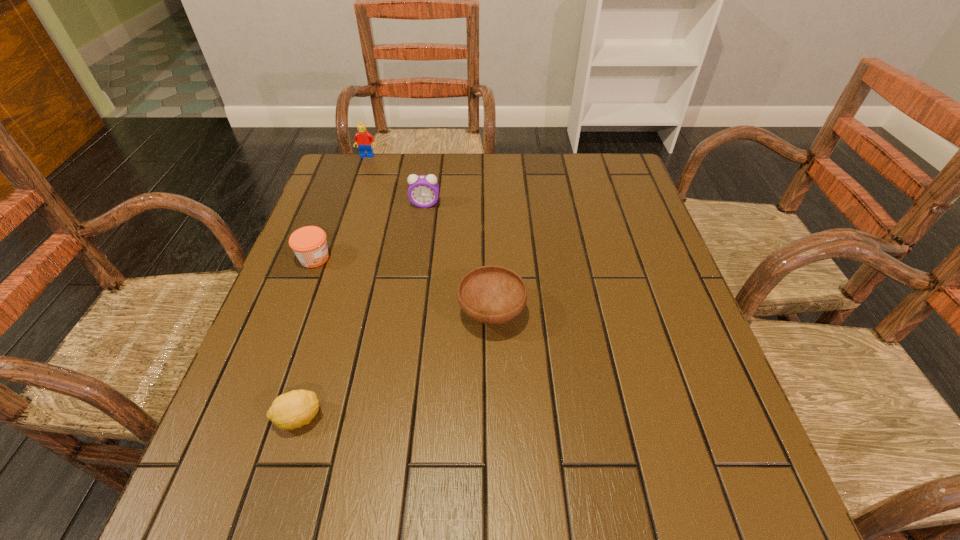
This screenshot has width=960, height=540. In order to click on free area in between the rightmost object and the second tallest object in this screenshot , I will do `click(458, 259)`.

What are the coordinates of `free spot between the farthest object and the second farthest object` in the screenshot? It's located at (396, 180).

Locate an element on the screen. This screenshot has width=960, height=540. vacant region between the jam and the tallest object is located at coordinates (341, 207).

At what (x,y) coordinates should I click in order to perform the action: click on free space between the jam and the tallest object. Please return your answer as a coordinate pair (x, y). Looking at the image, I should click on (341, 207).

This screenshot has width=960, height=540. I want to click on object that stands as the third closest to the nearest object, so click(423, 191).

At what (x,y) coordinates should I click in order to perform the action: click on object that ranks as the fourth closest to the jam. Please return your answer as a coordinate pair (x, y). Looking at the image, I should click on (364, 140).

The image size is (960, 540). I want to click on free location that satisfies the following two spatial constraints: 1. on the face of the tallest object; 2. on the front label of the jam, so click(333, 258).

Find the location of a particular element. Image resolution: width=960 pixels, height=540 pixels. free space that satisfies the following two spatial constraints: 1. on the face of the tallest object; 2. on the front label of the jam is located at coordinates (333, 258).

The image size is (960, 540). I want to click on free space that satisfies the following two spatial constraints: 1. on the front label of the rightmost object; 2. on the left side of the third farthest object, so click(x=294, y=313).

This screenshot has height=540, width=960. Identify the location of vacant space that satisfies the following two spatial constraints: 1. on the front label of the third farthest object; 2. on the right side of the rightmost object. (294, 313).